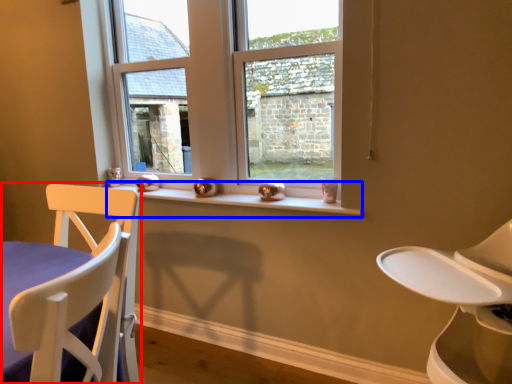
Question: Which object appears farthest to the camera in this image, chair (highlighted by a red box) or window sill (highlighted by a blue box)?

Choices:
 (A) chair
 (B) window sill

Answer: (B)